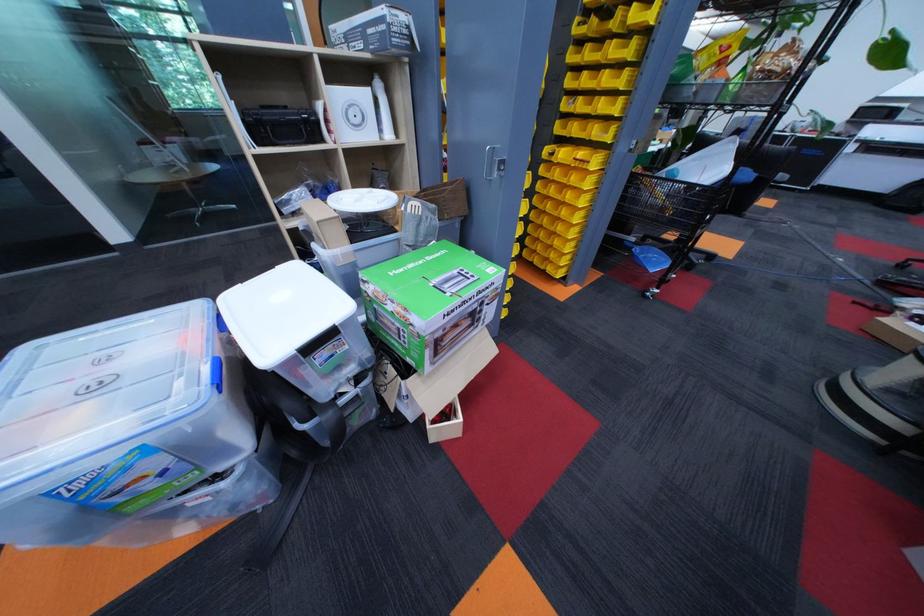
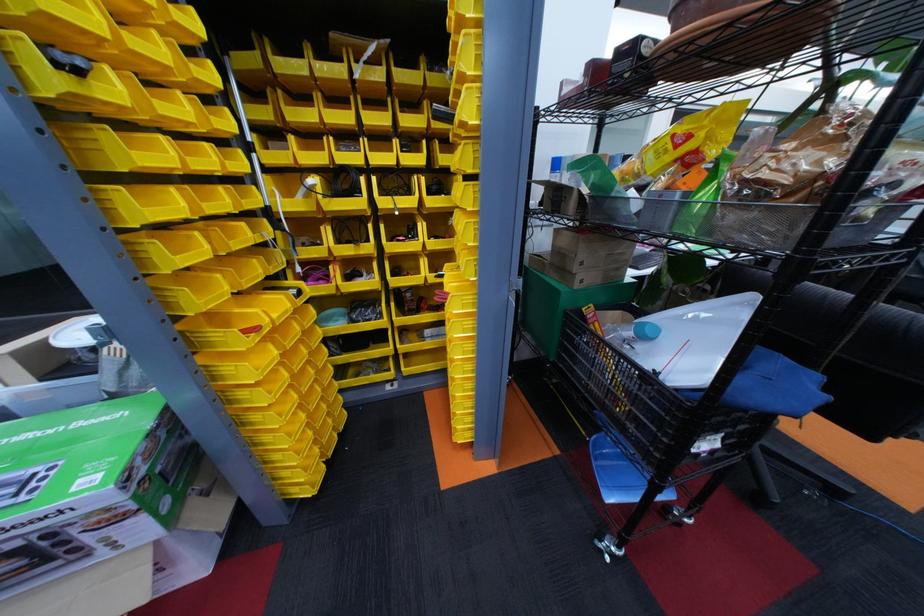
The point at (565,155) is marked in the first image. Where is the corresponding point in the second image?

(456, 277)